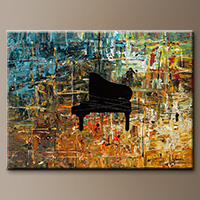
Find the location of a particular element. piano is located at coordinates (100, 101).